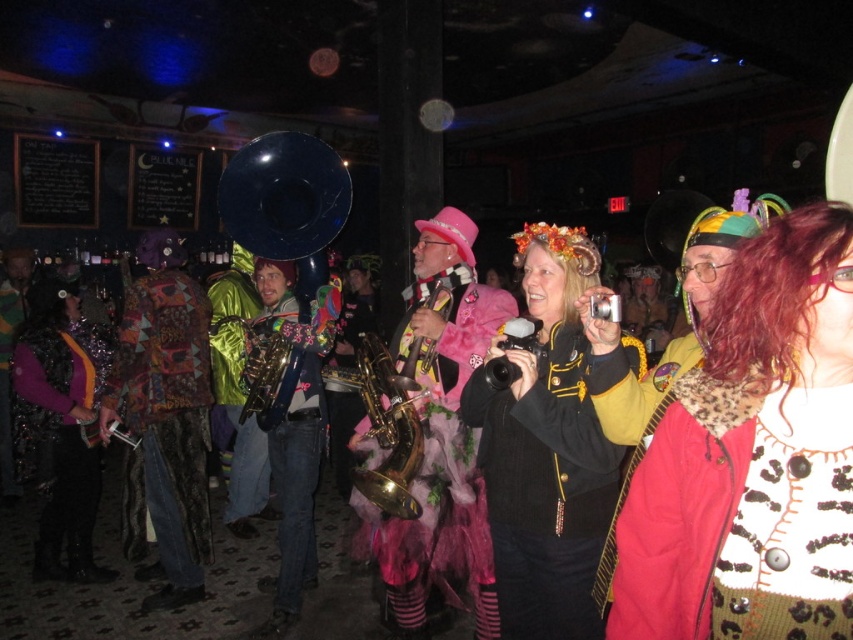
Between multicolored woven fabric at center and shiny metallic saxophone at center, which one is positioned higher?

Positioned higher is shiny metallic saxophone at center.

Measure the distance between point (157, 472) and camera.

The distance of point (157, 472) from camera is 3.74 meters.

This screenshot has height=640, width=853. I want to click on multicolored woven fabric at center, so click(164, 420).

Can you confirm if shiny metallic vest at center is smaller than shiny metallic saxophone at center?

No.

Which is behind, point (48, 308) or point (326, 305)?

The point (48, 308) is behind.

This screenshot has width=853, height=640. Identify the location of shiny metallic vest at center. (61, 426).

From the picture: Who is more distant from viewer, (38,419) or (396,404)?

The point (38,419) is behind.

Between shiny metallic vest at center and gold brass saxophone at center, which one has more height?

Standing taller between the two is shiny metallic vest at center.

What do you see at coordinates (61, 426) in the screenshot? I see `shiny metallic vest at center` at bounding box center [61, 426].

Identify the location of shiny metallic vest at center. The height and width of the screenshot is (640, 853). (61, 426).